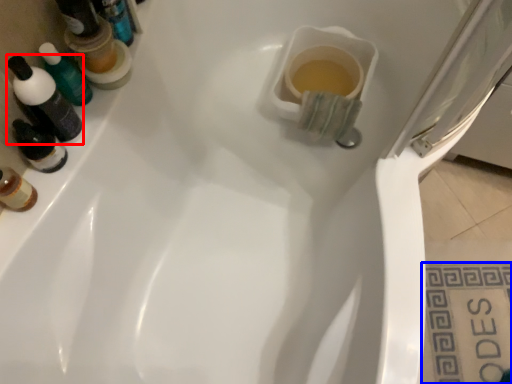
Question: Which of the following is the farthest to the observer, mouthwash (highlighted by a red box) or tile (highlighted by a blue box)?

Choices:
 (A) mouthwash
 (B) tile

Answer: (B)